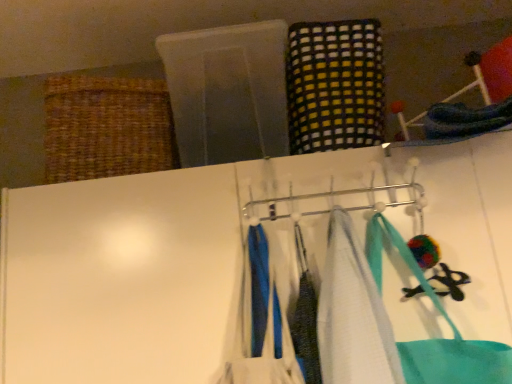
Locate an element on the screen. Image resolution: width=512 pixels, height=384 pixels. multicolored woven cloth at upper center, which ranks as the second clothing in left-to-right order is located at coordinates [x=335, y=85].

Image resolution: width=512 pixels, height=384 pixels. What do you see at coordinates (334, 201) in the screenshot?
I see `metallic silver hanger at center` at bounding box center [334, 201].

Measure the distance between point (345, 256) and camera.

36.42 inches.

Locate an element on the screen. The image size is (512, 384). woven brown basket at upper left is located at coordinates (106, 127).

Describe the element at coordinates (106, 127) in the screenshot. I see `woven brown basket at upper left` at that location.

Where is `multicolored woven cloth at upper center, which is the first clothing in right-to-left order`? The image size is (512, 384). multicolored woven cloth at upper center, which is the first clothing in right-to-left order is located at coordinates (335, 85).

Considering the sizes of objects white fabric towel at center and metallic silver hanger at center in the image provided, who is thinner, white fabric towel at center or metallic silver hanger at center?

metallic silver hanger at center is thinner.

From their relative heights in the image, would you say white fabric towel at center is taller or shorter than metallic silver hanger at center?

Clearly, white fabric towel at center is taller compared to metallic silver hanger at center.

Which object is positioned more to the right, white fabric towel at center or metallic silver hanger at center?

From the viewer's perspective, white fabric towel at center appears more on the right side.

Is white fabric towel at center wider than woven brown basket at upper left?

No, white fabric towel at center is not wider than woven brown basket at upper left.

Based on the photo, considering the relative sizes of white fabric towel at center and woven brown basket at upper left in the image provided, is white fabric towel at center bigger than woven brown basket at upper left?

Actually, white fabric towel at center might be smaller than woven brown basket at upper left.

Does white fabric towel at center turn towards woven brown basket at upper left?

No, white fabric towel at center is not facing towards woven brown basket at upper left.

What's the angular difference between white fabric towel at center and woven brown basket at upper left's facing directions?

The facing directions of white fabric towel at center and woven brown basket at upper left are 9.47 degrees apart.

Considering their positions, is multicolored woven cloth at upper center, marked as the second clothing in a front-to-back arrangement, located in front of or behind white fabric towel at center?

multicolored woven cloth at upper center, marked as the second clothing in a front-to-back arrangement, is positioned farther from the viewer than white fabric towel at center.

Is multicolored woven cloth at upper center, marked as the second clothing in a front-to-back arrangement, next to white fabric towel at center and touching it?

There is a gap between multicolored woven cloth at upper center, marked as the second clothing in a front-to-back arrangement, and white fabric towel at center.

You are a GUI agent. You are given a task and a screenshot of the screen. Output one action in this format:
    pyautogui.click(x=<x>, y=<y>)
    Task: Click on the towel located underneath the multicolored woven cloth at upper center, placed as the 1th clothing when sorted from top to bottom (from a real-world perspective)
    The image size is (512, 384).
    Given the screenshot: What is the action you would take?
    [353, 314]

Is multicolored woven cloth at upper center, marked as the 2th clothing in a bottom-to-top arrangement, bigger than white fabric towel at center?

Indeed, multicolored woven cloth at upper center, marked as the 2th clothing in a bottom-to-top arrangement, has a larger size compared to white fabric towel at center.

Is multicolored woven cloth at upper center, marked as the 2th clothing in a bottom-to-top arrangement, at the right side of blue fabric at center, which is the second clothing in right-to-left order?

Correct, you'll find multicolored woven cloth at upper center, marked as the 2th clothing in a bottom-to-top arrangement, to the right of blue fabric at center, which is the second clothing in right-to-left order.

Between point (362, 44) and point (251, 344), which one is positioned in front?

The point (251, 344) is in front.

Looking at this image, which object is closer to the camera, multicolored woven cloth at upper center, marked as the 2th clothing in a bottom-to-top arrangement, or blue fabric at center, the 1th clothing positioned from the front?

blue fabric at center, the 1th clothing positioned from the front, is closer to the camera.

Is multicolored woven cloth at upper center, placed as the first clothing when sorted from back to front, completely or partially outside of blue fabric at center, the second clothing when ordered from top to bottom?

Yes, multicolored woven cloth at upper center, placed as the first clothing when sorted from back to front, is not within blue fabric at center, the second clothing when ordered from top to bottom.

Considering the positions of points (261, 325) and (51, 103), is point (261, 325) farther from camera compared to point (51, 103)?

No, it is in front of (51, 103).

Does blue fabric at center, which is the second clothing in right-to-left order, have a larger size compared to woven brown basket at upper left?

No.

Looking at this image, from the image's perspective, would you say blue fabric at center, which is the second clothing in right-to-left order, is positioned over woven brown basket at upper left?

No, from the image's perspective, blue fabric at center, which is the second clothing in right-to-left order, is not over woven brown basket at upper left.

Does blue fabric at center, placed as the 2th clothing when sorted from back to front, have a greater height compared to woven brown basket at upper left?

Yes.

Between woven brown basket at upper left and metallic silver hanger at center, which one appears on the right side from the viewer's perspective?

From the viewer's perspective, metallic silver hanger at center appears more on the right side.

Is there a large distance between woven brown basket at upper left and metallic silver hanger at center?

woven brown basket at upper left is near metallic silver hanger at center, not far away.

In terms of size, does woven brown basket at upper left appear bigger or smaller than metallic silver hanger at center?

Considering their sizes, woven brown basket at upper left takes up more space than metallic silver hanger at center.

Does metallic silver hanger at center lie in front of multicolored woven cloth at upper center, marked as the 2th clothing in a bottom-to-top arrangement?

Yes, metallic silver hanger at center is closer to the viewer.

Which is closer to the camera, [386,190] or [288,54]?

Positioned in front is point [386,190].

From a real-world perspective, between metallic silver hanger at center and multicolored woven cloth at upper center, which is the first clothing in right-to-left order, who is vertically higher?

From a 3D spatial view, multicolored woven cloth at upper center, which is the first clothing in right-to-left order, is above.

Which of these two, metallic silver hanger at center or multicolored woven cloth at upper center, marked as the 2th clothing in a bottom-to-top arrangement, is bigger?

multicolored woven cloth at upper center, marked as the 2th clothing in a bottom-to-top arrangement, is bigger.

Locate an element on the screen. Image resolution: width=512 pixels, height=384 pixels. towel that appears below the metallic silver hanger at center (from the image's perspective) is located at coordinates point(353,314).

The image size is (512, 384). I want to click on basket behind the white fabric towel at center, so click(x=106, y=127).

Estimate the real-world distances between objects in this image. Which object is further from woven brown basket at upper left, white fabric towel at center or metallic silver hanger at center?

white fabric towel at center is positioned further to the anchor woven brown basket at upper left.

When comparing their distances from multicolored woven cloth at upper center, marked as the 2th clothing in a bottom-to-top arrangement, does woven brown basket at upper left or blue fabric at center, placed as the 2th clothing when sorted from back to front, seem closer?

blue fabric at center, placed as the 2th clothing when sorted from back to front, is closer to multicolored woven cloth at upper center, marked as the 2th clothing in a bottom-to-top arrangement.

Looking at the image, which one is located closer to woven brown basket at upper left, blue fabric at center, placed as the 2th clothing when sorted from back to front, or metallic silver hanger at center?

Based on the image, metallic silver hanger at center appears to be nearer to woven brown basket at upper left.

Considering their positions, is blue fabric at center, the 1th clothing positioned from the front, positioned further to white fabric towel at center than multicolored woven cloth at upper center, marked as the second clothing in a front-to-back arrangement?

Among the two, multicolored woven cloth at upper center, marked as the second clothing in a front-to-back arrangement, is located further to white fabric towel at center.

From the picture: Estimate the real-world distances between objects in this image. Which object is closer to woven brown basket at upper left, multicolored woven cloth at upper center, which ranks as the second clothing in left-to-right order, or blue fabric at center, positioned as the 1th clothing in left-to-right order?

Among the two, multicolored woven cloth at upper center, which ranks as the second clothing in left-to-right order, is located nearer to woven brown basket at upper left.

Which object lies further to the anchor point blue fabric at center, placed as the 2th clothing when sorted from back to front, multicolored woven cloth at upper center, placed as the first clothing when sorted from back to front, or woven brown basket at upper left?

woven brown basket at upper left is further to blue fabric at center, placed as the 2th clothing when sorted from back to front.

Based on their spatial positions, is multicolored woven cloth at upper center, marked as the 2th clothing in a bottom-to-top arrangement, or metallic silver hanger at center further from woven brown basket at upper left?

Based on the image, multicolored woven cloth at upper center, marked as the 2th clothing in a bottom-to-top arrangement, appears to be further to woven brown basket at upper left.

From the image, which object appears to be farther from metallic silver hanger at center, woven brown basket at upper left or white fabric towel at center?

woven brown basket at upper left is further to metallic silver hanger at center.

Where is `hanger between multicolored woven cloth at upper center, which is the first clothing in right-to-left order, and white fabric towel at center, in the vertical direction`? This screenshot has height=384, width=512. hanger between multicolored woven cloth at upper center, which is the first clothing in right-to-left order, and white fabric towel at center, in the vertical direction is located at coordinates (334, 201).

I want to click on clothing between woven brown basket at upper left and white fabric towel at center, so [259, 324].

This screenshot has height=384, width=512. I want to click on clothing between multicolored woven cloth at upper center, placed as the first clothing when sorted from back to front, and white fabric towel at center, in the vertical direction, so click(x=259, y=324).

In order to click on clothing between metallic silver hanger at center and white fabric towel at center in the vertical direction in this screenshot , I will do `click(259, 324)`.